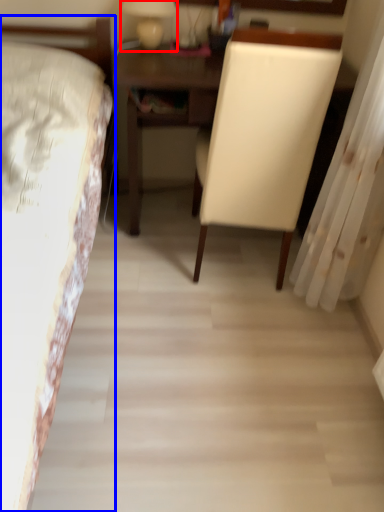
Question: Among these objects, which one is nearest to the camera, bedside lamp (highlighted by a red box) or bed (highlighted by a blue box)?

Choices:
 (A) bedside lamp
 (B) bed

Answer: (B)